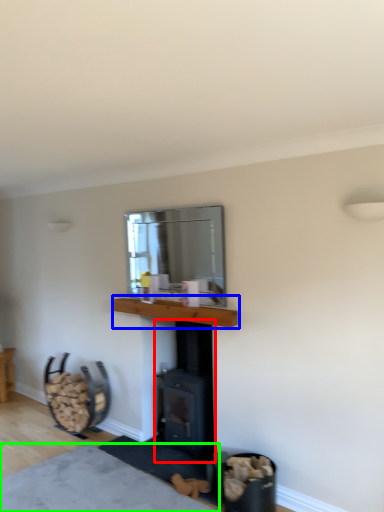
Question: Considering the real-world distances, which object is closest to wood burning stove (highlighted by a red box)? counter top (highlighted by a blue box) or plain (highlighted by a green box).

Choices:
 (A) counter top
 (B) plain

Answer: (A)